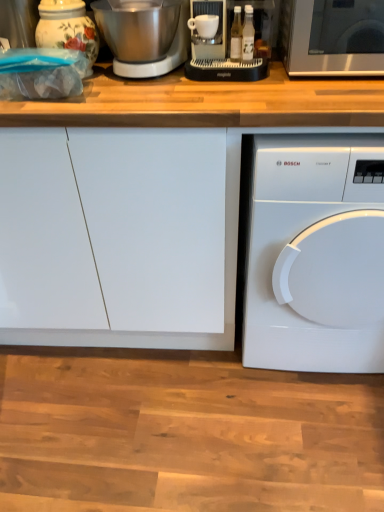
Question: Is white glossy dishwasher at lower right wider than porcelain floral jar at upper left?

Choices:
 (A) no
 (B) yes

Answer: (B)

Question: Is white glossy dishwasher at lower right positioned beyond the bounds of porcelain floral jar at upper left?

Choices:
 (A) no
 (B) yes

Answer: (B)

Question: Is white glossy dishwasher at lower right positioned in front of porcelain floral jar at upper left?

Choices:
 (A) no
 (B) yes

Answer: (B)

Question: Could you tell me if white glossy dishwasher at lower right is turned towards porcelain floral jar at upper left?

Choices:
 (A) no
 (B) yes

Answer: (A)

Question: Does white glossy dishwasher at lower right have a smaller size compared to porcelain floral jar at upper left?

Choices:
 (A) yes
 (B) no

Answer: (B)

Question: From a real-world perspective, is wooden at upper center above or below porcelain floral jar at upper left?

Choices:
 (A) below
 (B) above

Answer: (A)

Question: From their relative heights in the image, would you say wooden at upper center is taller or shorter than porcelain floral jar at upper left?

Choices:
 (A) short
 (B) tall

Answer: (B)

Question: Is wooden at upper center situated inside porcelain floral jar at upper left or outside?

Choices:
 (A) outside
 (B) inside

Answer: (A)

Question: Is point (200, 86) closer or farther from the camera than point (39, 31)?

Choices:
 (A) closer
 (B) farther

Answer: (A)

Question: Based on their sizes in the image, would you say wooden at upper center is bigger or smaller than sleek silver microwave at upper right?

Choices:
 (A) big
 (B) small

Answer: (A)

Question: Is wooden at upper center to the left or to the right of sleek silver microwave at upper right in the image?

Choices:
 (A) right
 (B) left

Answer: (B)

Question: In the image, is wooden at upper center positioned in front of or behind sleek silver microwave at upper right?

Choices:
 (A) behind
 (B) front

Answer: (B)

Question: Considering the positions of point (259, 98) and point (340, 42), is point (259, 98) closer or farther from the camera than point (340, 42)?

Choices:
 (A) closer
 (B) farther

Answer: (A)

Question: Is white glossy dishwasher at lower right spatially inside wooden at upper center, or outside of it?

Choices:
 (A) outside
 (B) inside

Answer: (B)

Question: From a real-world perspective, is white glossy dishwasher at lower right positioned above or below wooden at upper center?

Choices:
 (A) below
 (B) above

Answer: (A)